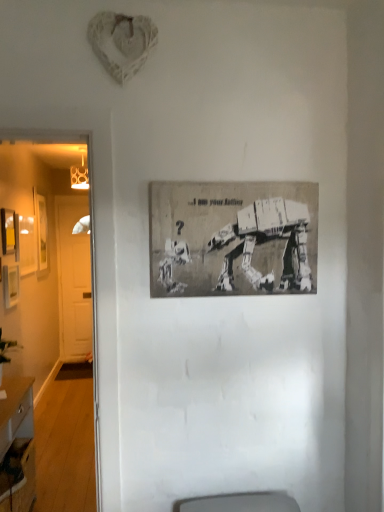
Question: Can you confirm if matte yellow picture frame at left, which is the third picture frame in right-to-left order, is thinner than wooden desk at lower left?

Choices:
 (A) yes
 (B) no

Answer: (A)

Question: Can you confirm if matte yellow picture frame at left, which is the third picture frame in right-to-left order, is bigger than wooden desk at lower left?

Choices:
 (A) yes
 (B) no

Answer: (B)

Question: Is matte yellow picture frame at left, which ranks as the 3th picture frame in back-to-front order, facing towards wooden desk at lower left?

Choices:
 (A) no
 (B) yes

Answer: (A)

Question: Can you confirm if matte yellow picture frame at left, which is the third picture frame in right-to-left order, is positioned to the left of wooden desk at lower left?

Choices:
 (A) yes
 (B) no

Answer: (A)

Question: Is matte yellow picture frame at left, which appears as the 2th picture frame when viewed from the front, not inside wooden desk at lower left?

Choices:
 (A) no
 (B) yes

Answer: (B)

Question: Is matte yellow picture frame at left, which is the third picture frame in right-to-left order, positioned behind wooden desk at lower left?

Choices:
 (A) no
 (B) yes

Answer: (B)

Question: From a real-world perspective, is white wooden door at left beneath matte yellow picture frame at left, which ranks as the 3th picture frame in back-to-front order?

Choices:
 (A) no
 (B) yes

Answer: (B)

Question: Can you see white wooden door at left touching matte yellow picture frame at left, which ranks as the 3th picture frame in back-to-front order?

Choices:
 (A) no
 (B) yes

Answer: (A)

Question: Considering the relative sizes of white wooden door at left and matte yellow picture frame at left, which ranks as the 3th picture frame in back-to-front order, in the image provided, is white wooden door at left shorter than matte yellow picture frame at left, which ranks as the 3th picture frame in back-to-front order,?

Choices:
 (A) yes
 (B) no

Answer: (B)

Question: From a real-world perspective, is white wooden door at left over matte yellow picture frame at left, which is the third picture frame in right-to-left order?

Choices:
 (A) no
 (B) yes

Answer: (A)

Question: Is matte yellow picture frame at left, the 2th picture frame from the left, located within white wooden door at left?

Choices:
 (A) yes
 (B) no

Answer: (B)

Question: Is white wooden door at left closer to the viewer compared to matte yellow picture frame at left, which is the third picture frame in right-to-left order?

Choices:
 (A) no
 (B) yes

Answer: (A)

Question: Considering the relative sizes of gray paper poster at center, the 4th picture frame positioned from the back, and wooden picture frame at left, arranged as the 4th picture frame when viewed from the right, in the image provided, is gray paper poster at center, the 4th picture frame positioned from the back, bigger than wooden picture frame at left, arranged as the 4th picture frame when viewed from the right,?

Choices:
 (A) no
 (B) yes

Answer: (A)